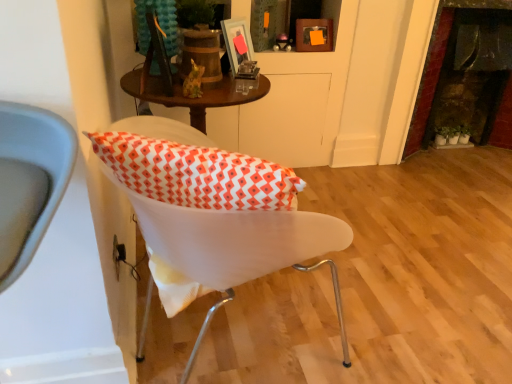
Question: From a real-world perspective, is matte glass picture frame at upper center, which is the 2th picture frame in left-to-right order, physically below metallic silver picture frame at upper center, which is the 1th picture frame in left-to-right order?

Choices:
 (A) yes
 (B) no

Answer: (A)

Question: Is metallic silver picture frame at upper center, which is the third picture frame in back-to-front order, a part of matte glass picture frame at upper center, which is the second picture frame in back-to-front order?

Choices:
 (A) no
 (B) yes

Answer: (A)

Question: Is matte glass picture frame at upper center, the second picture frame in the front-to-back sequence, bigger than metallic silver picture frame at upper center, the third picture frame viewed from the right?

Choices:
 (A) no
 (B) yes

Answer: (B)

Question: From a real-world perspective, is matte glass picture frame at upper center, which ranks as the second picture frame in right-to-left order, physically above metallic silver picture frame at upper center, which is the first picture frame in front-to-back order?

Choices:
 (A) no
 (B) yes

Answer: (A)

Question: Is there a large distance between matte glass picture frame at upper center, which is the 2th picture frame in left-to-right order, and metallic silver picture frame at upper center, which is the first picture frame in front-to-back order?

Choices:
 (A) yes
 (B) no

Answer: (B)

Question: Considering their positions, is wooden picture frame at upper center, which appears as the 1th picture frame when viewed from the right, located in front of or behind dark stone fireplace at right?

Choices:
 (A) behind
 (B) front

Answer: (B)

Question: Visually, is wooden picture frame at upper center, marked as the 3th picture frame in a left-to-right arrangement, positioned to the left or to the right of dark stone fireplace at right?

Choices:
 (A) left
 (B) right

Answer: (A)

Question: From the image's perspective, relative to dark stone fireplace at right, is wooden picture frame at upper center, marked as the 3th picture frame in a left-to-right arrangement, above or below?

Choices:
 (A) above
 (B) below

Answer: (A)

Question: Looking at their shapes, would you say wooden picture frame at upper center, which appears as the 1th picture frame when viewed from the right, is wider or thinner than dark stone fireplace at right?

Choices:
 (A) thin
 (B) wide

Answer: (A)

Question: Is matte glass picture frame at upper center, the second picture frame in the front-to-back sequence, wider or thinner than green matte plant at right?

Choices:
 (A) thin
 (B) wide

Answer: (A)

Question: Is point (240, 21) closer or farther from the camera than point (436, 137)?

Choices:
 (A) closer
 (B) farther

Answer: (A)

Question: Considering their positions, is matte glass picture frame at upper center, which is the 2th picture frame in left-to-right order, located in front of or behind green matte plant at right?

Choices:
 (A) front
 (B) behind

Answer: (A)

Question: From the image's perspective, is matte glass picture frame at upper center, which ranks as the second picture frame in right-to-left order, located above or below green matte plant at right?

Choices:
 (A) above
 (B) below

Answer: (A)

Question: Is metallic silver picture frame at upper center, which is the 1th picture frame in left-to-right order, bigger or smaller than green matte plant at right?

Choices:
 (A) small
 (B) big

Answer: (B)

Question: From a real-world perspective, is metallic silver picture frame at upper center, which is the third picture frame in back-to-front order, positioned above or below green matte plant at right?

Choices:
 (A) above
 (B) below

Answer: (A)